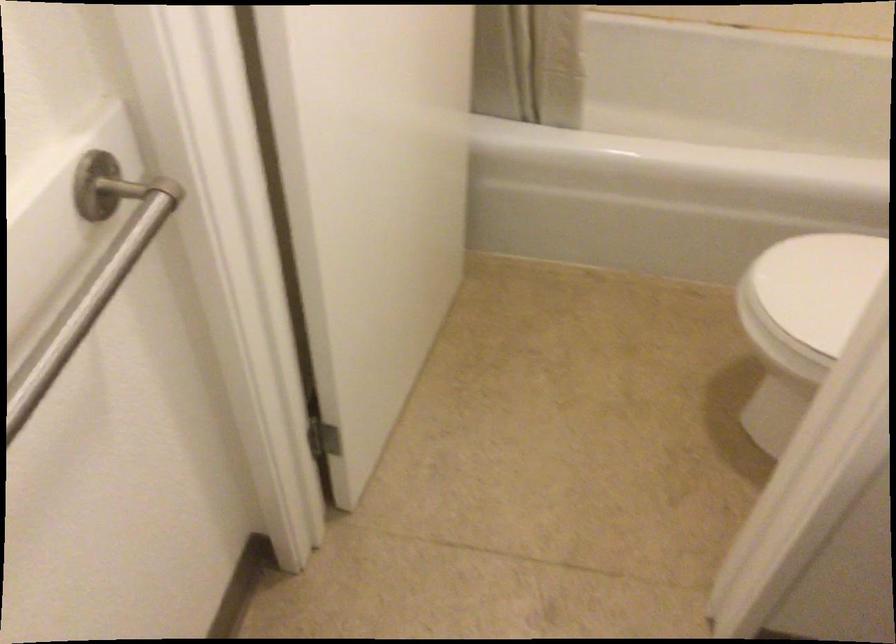
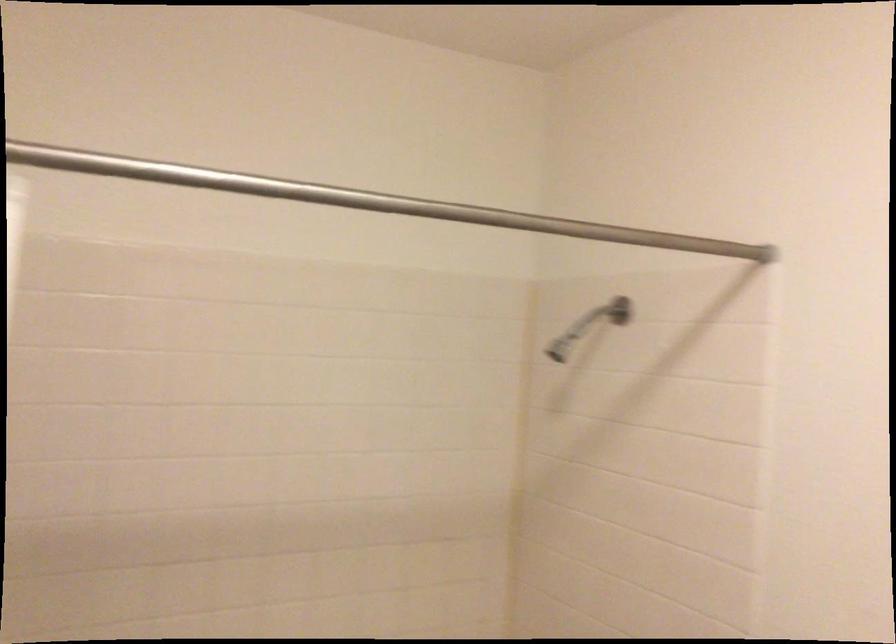
First-person continuous shooting, in which direction is the camera rotating?

The rotation direction of the camera is right-up.